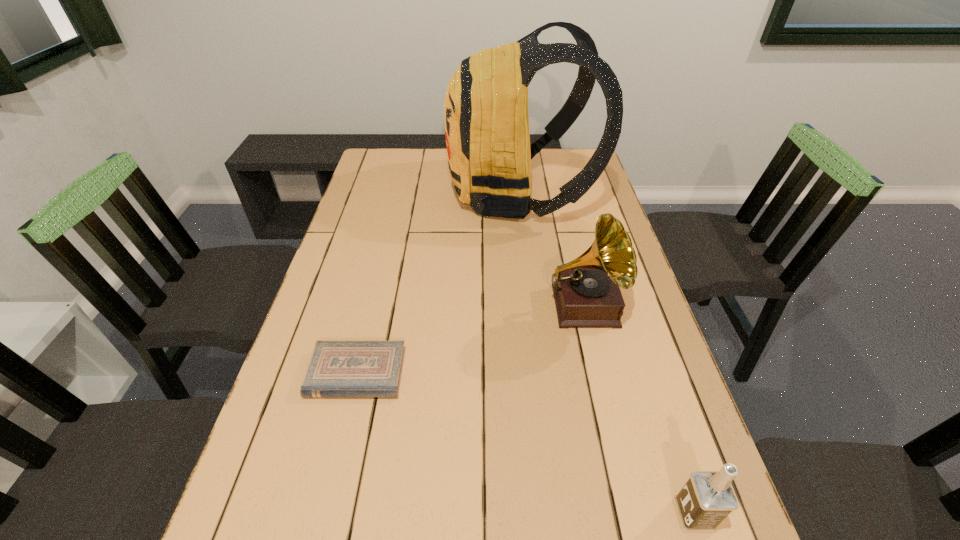
Image resolution: width=960 pixels, height=540 pixels. I want to click on vodka that is at the right edge, so click(x=707, y=498).

The image size is (960, 540). I want to click on object located at the far right corner, so click(x=486, y=118).

Image resolution: width=960 pixels, height=540 pixels. What are the coordinates of `free space at the far edge of the desktop` in the screenshot? It's located at (419, 176).

Locate an element on the screen. free space at the left edge is located at coordinates (248, 530).

In the image, there is a desktop. Where is `free region at the right edge`? Image resolution: width=960 pixels, height=540 pixels. free region at the right edge is located at coordinates (559, 190).

In the image, there is a desktop. Where is `vacant region at the far left corner`? vacant region at the far left corner is located at coordinates (380, 156).

This screenshot has width=960, height=540. I want to click on vacant space at the far right corner, so tap(578, 171).

The width and height of the screenshot is (960, 540). Find the location of `unoccupied position between the third farthest object and the third shortest object`. unoccupied position between the third farthest object and the third shortest object is located at coordinates (470, 340).

You are a GUI agent. You are given a task and a screenshot of the screen. Output one action in this format:
    pyautogui.click(x=<x>, y=<y>)
    Task: Click on the unoccupied position between the second shortest object and the leftmost object
    This screenshot has height=540, width=960.
    Given the screenshot: What is the action you would take?
    pyautogui.click(x=525, y=444)

Where is `empty space that is in between the phonograph record and the shortest object`? Image resolution: width=960 pixels, height=540 pixels. empty space that is in between the phonograph record and the shortest object is located at coordinates (470, 340).